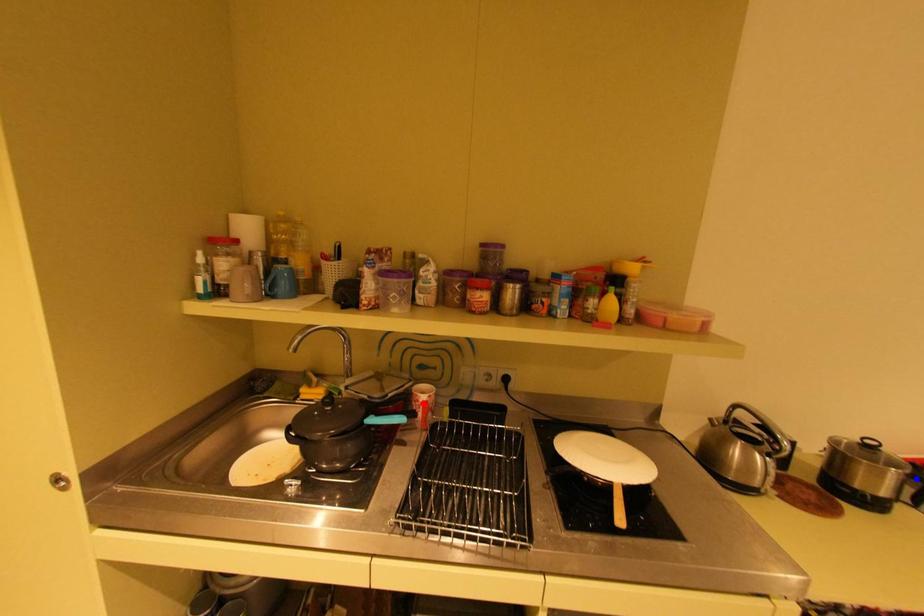
Question: In the image, two points are highlighted. Which point is nearer to the camera? Reply with the corresponding letter.

Choices:
 (A) blue point
 (B) red point

Answer: (A)